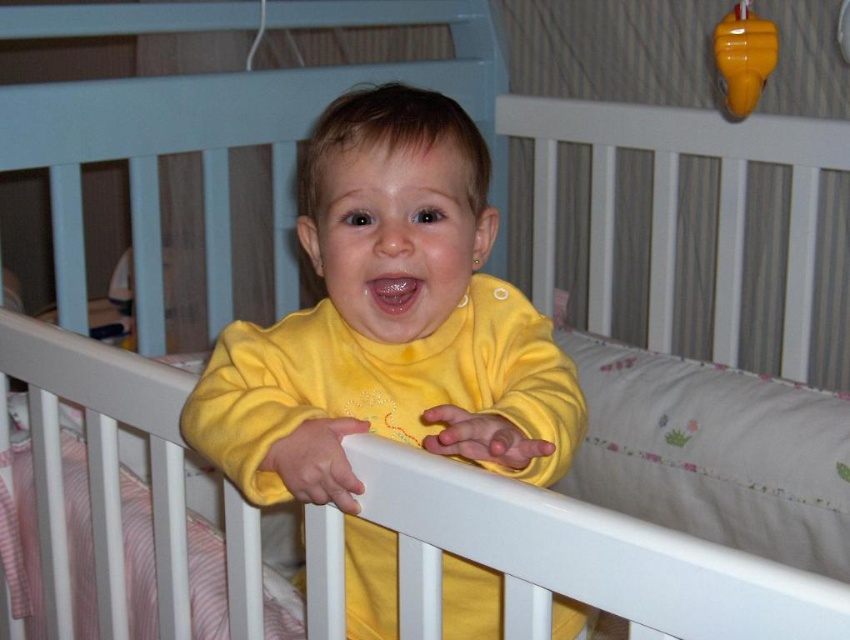
You are a parent looking at your baby in the crib. You want to give the shiny yellow rattle at upper right to the yellow fleece baby at center. Can the baby reach it?

The yellow fleece baby at center is below the shiny yellow rattle at upper right, so the baby cannot reach the shiny yellow rattle at upper right.

You are a parent trying to place a shiny yellow rattle at upper right into the crib. Considering the size of the yellow fleece baby at center, will the rattle fit comfortably without being overcrowded?

The yellow fleece baby at center is wider than the shiny yellow rattle at upper right, so there should be enough space for the rattle to fit comfortably in the crib without overcrowding.